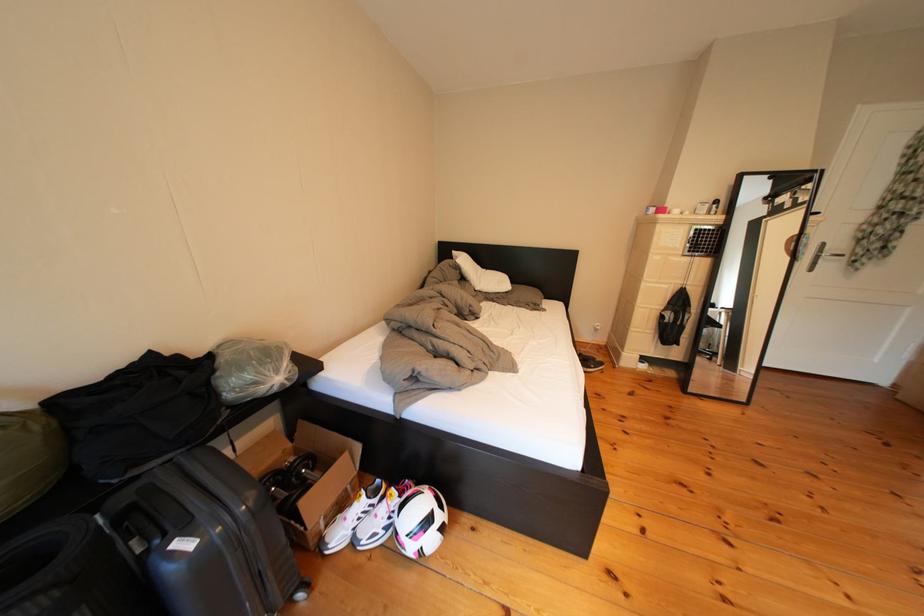
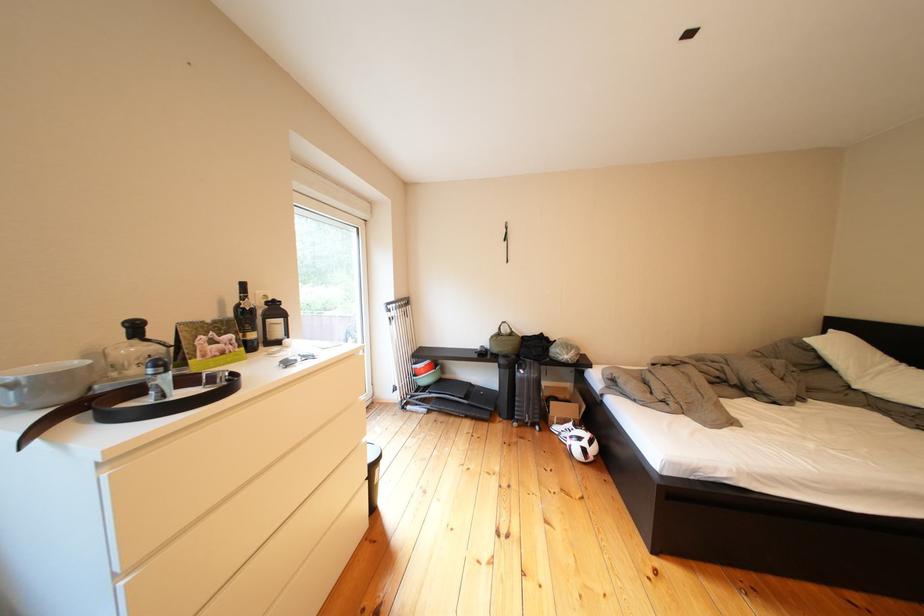
In the second image, find the point that corresponds to [351,541] in the first image.

(570, 432)